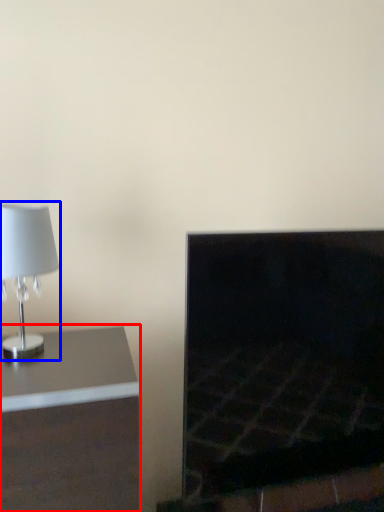
Question: Which point is closer to the camera, furniture (highlighted by a red box) or lamp (highlighted by a blue box)?

Choices:
 (A) furniture
 (B) lamp

Answer: (A)